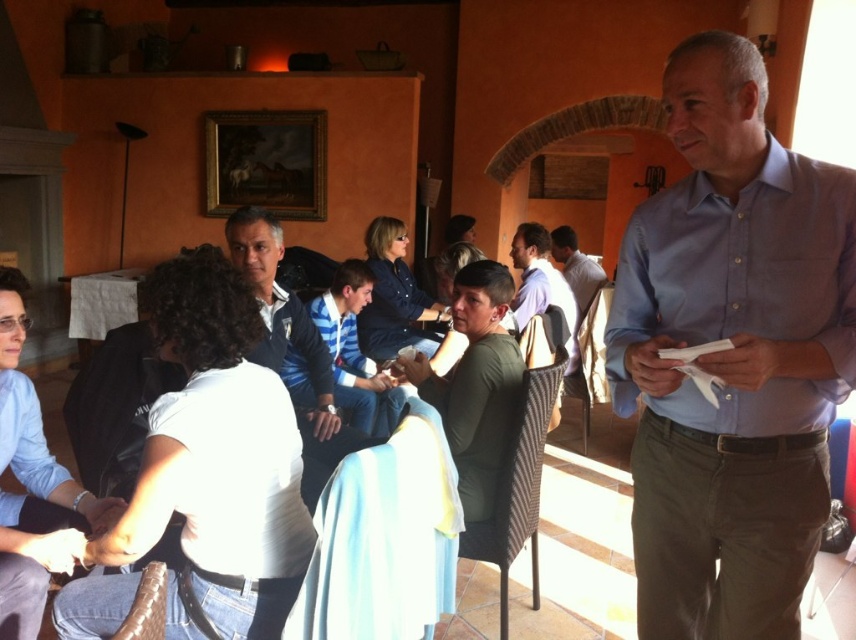
Question: Which point is closer to the camera taking this photo?

Choices:
 (A) (149, 618)
 (B) (590, 333)
 (C) (852, 538)
 (D) (556, 340)

Answer: (A)

Question: Observing the image, what is the correct spatial positioning of blue striped shirt at center in reference to matte blue shirt at center?

Choices:
 (A) below
 (B) above

Answer: (A)

Question: Which object is the farthest from the light blue fabric chair at center?

Choices:
 (A) dark green shirt at center
 (B) leather at lower left
 (C) blue striped shirt at center
 (D) woven brown chair at center

Answer: (D)

Question: Among these points, which one is nearest to the camera?

Choices:
 (A) (829, 230)
 (B) (589, 406)
 (C) (514, 480)
 (D) (589, 298)

Answer: (A)

Question: Is brown fabric chair at lower right behind matte blue shirt at center?

Choices:
 (A) no
 (B) yes

Answer: (A)

Question: Does blue striped shirt at center have a smaller size compared to leather at lower left?

Choices:
 (A) yes
 (B) no

Answer: (B)